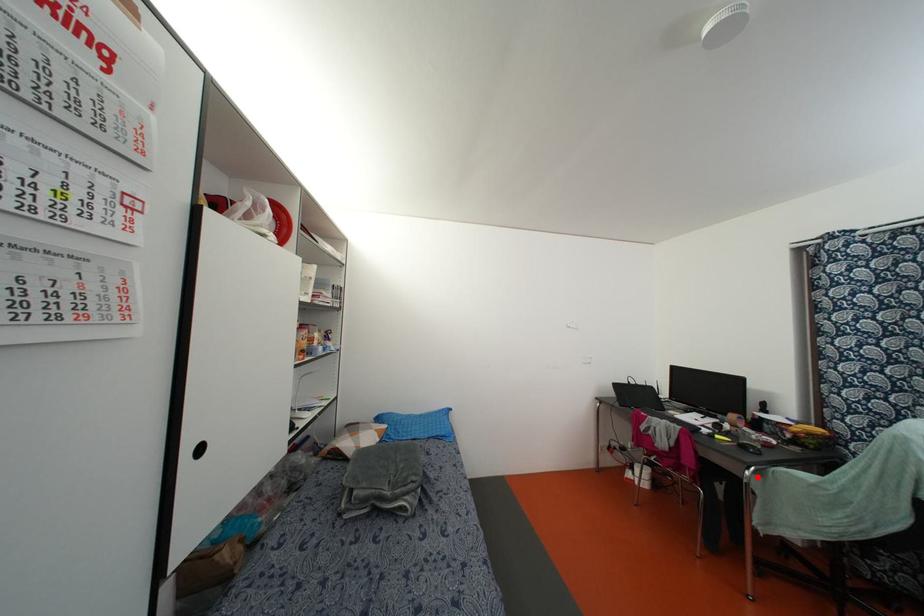
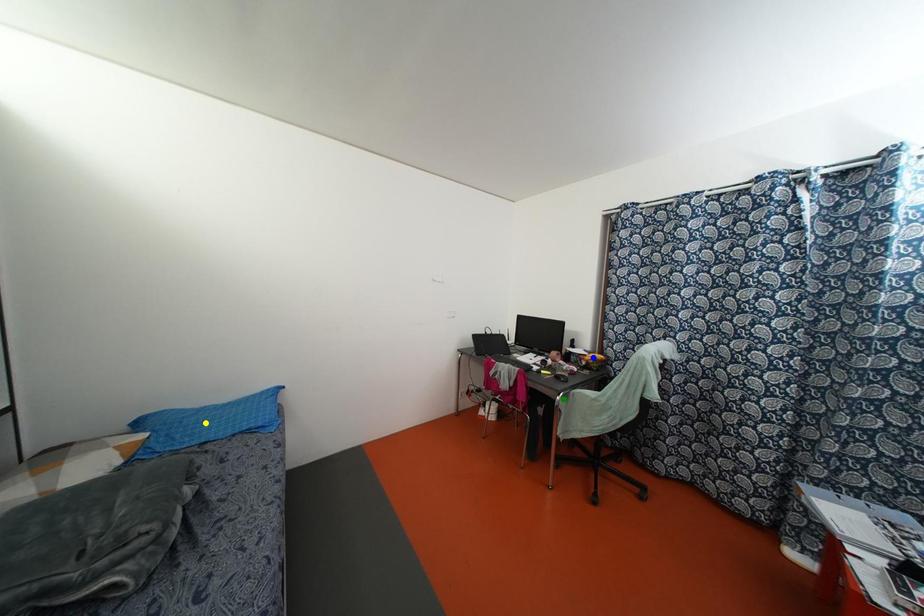
Question: I am providing you with two images of the same scene from different viewpoints. A red point is marked on the first image. You are given multiple points on the second image. Which spot in image 2 lines up with the point in image 1?

Choices:
 (A) blue point
 (B) yellow point
 (C) green point

Answer: (C)